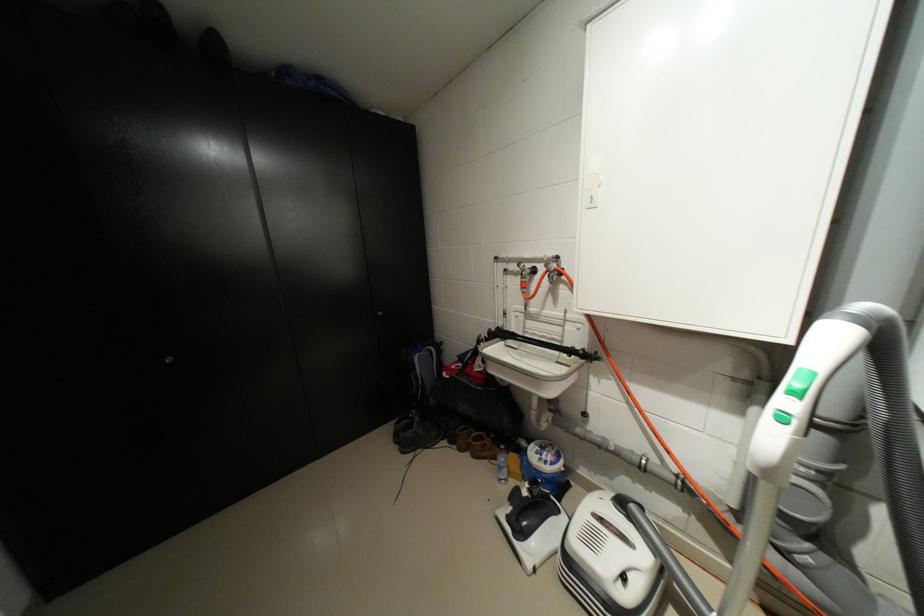
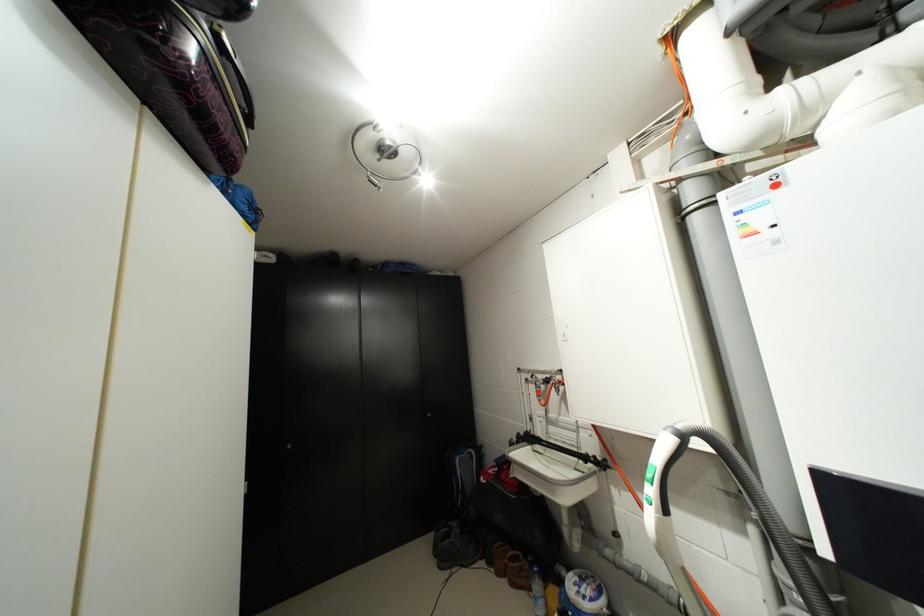
The point at (468, 450) is marked in the first image. Where is the corresponding point in the second image?

(505, 575)